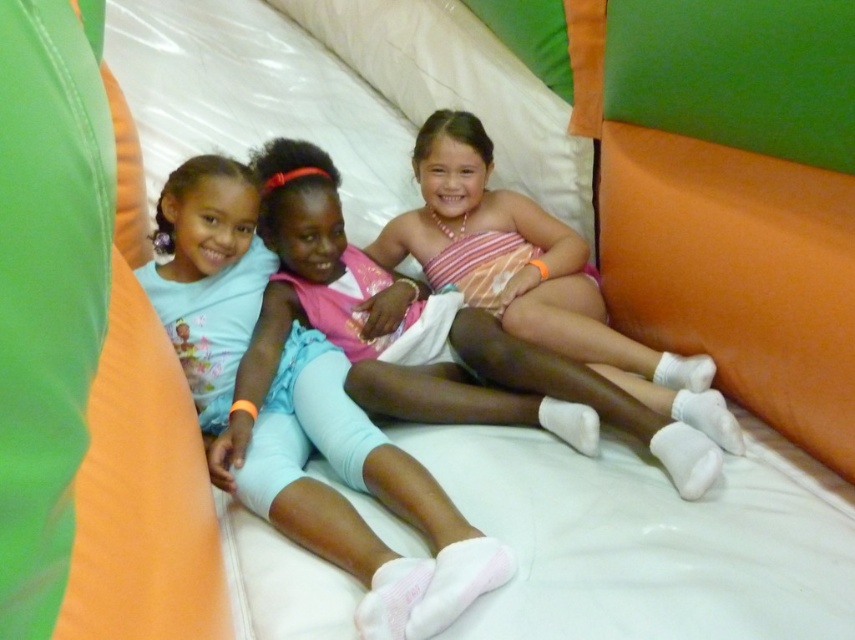
You are a photographer setting up a shoot inside a play tent. You need to ensure that the light blue fabric pants at center and the light blue leggings at center are visible in the final photo. Based on their positions, which one is closer to the camera?

The light blue fabric pants at center is in front of the light blue leggings at center, so the light blue fabric pants at center is closer to the camera.

You are a photographer trying to capture a group photo of the three girls sitting on the mattress. You need to ensure that both the light blue fabric pants at center and the light blue leggings at center are visible in the frame. Which one should you position closer to the left side of the camera to include both in the shot?

The light blue fabric pants at center is already positioned on the left side of the light blue leggings at center, so you should keep the light blue fabric pants at center on the left to ensure both are visible in the frame.